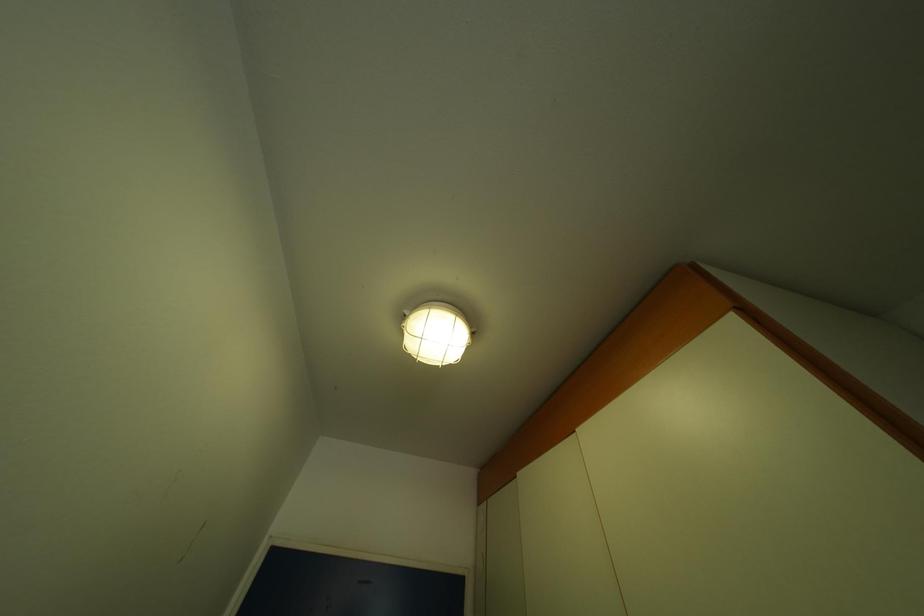
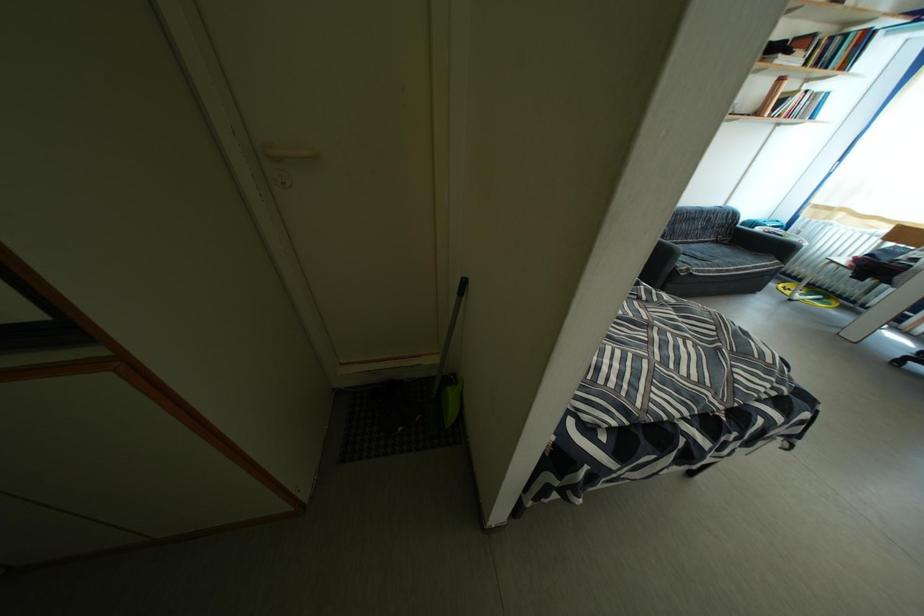
The first image is from the beginning of the video and the second image is from the end. How did the camera likely rotate when shooting the video?

The camera's rotation is toward right-down.